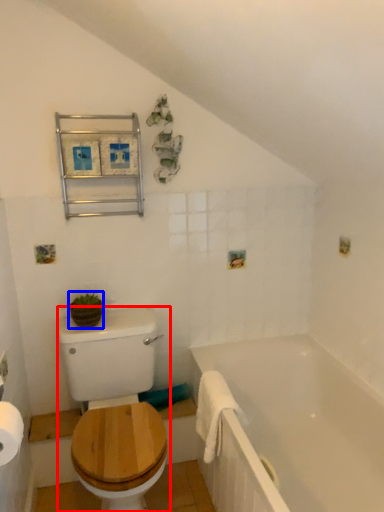
Question: Among these objects, which one is farthest to the camera, sit (highlighted by a red box) or plant (highlighted by a blue box)?

Choices:
 (A) sit
 (B) plant

Answer: (B)